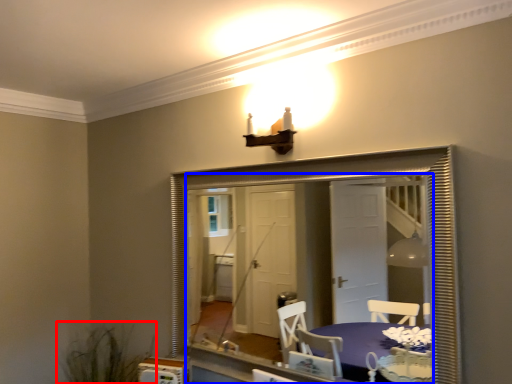
Question: Which of the following is the closest to the observer, plant (highlighted by a red box) or mirror (highlighted by a blue box)?

Choices:
 (A) plant
 (B) mirror

Answer: (B)